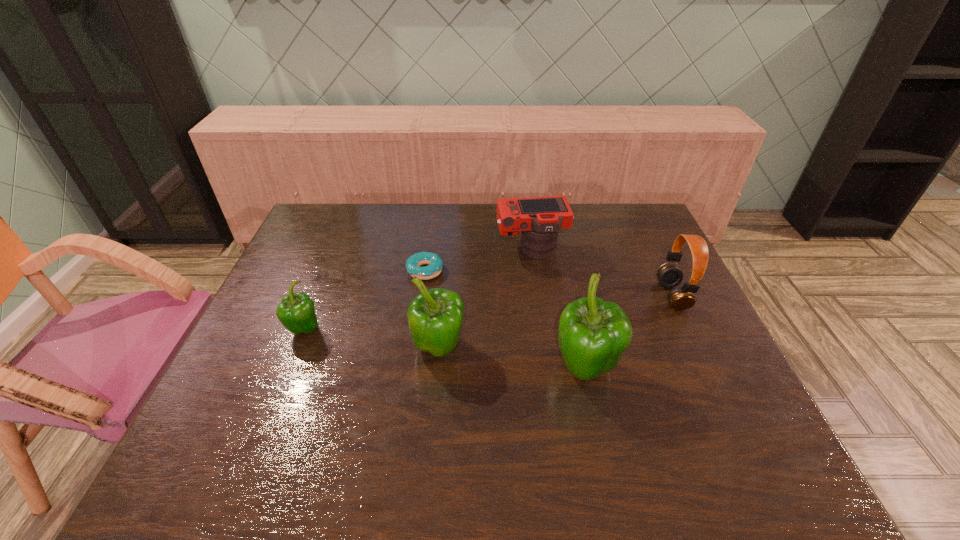
The height and width of the screenshot is (540, 960). In order to click on vacant space situated 0.280m on the front of the camera in this screenshot , I will do 544,333.

Find the location of a particular element. Image resolution: width=960 pixels, height=540 pixels. vacant space located 0.150m on the back of the doughnut is located at coordinates (431, 232).

Find the location of a particular element. The height and width of the screenshot is (540, 960). vacant space located on the ear cups of the headset is located at coordinates (572, 296).

Locate an element on the screen. The height and width of the screenshot is (540, 960). free region located 0.070m on the ear cups of the headset is located at coordinates (636, 296).

Locate an element on the screen. The width and height of the screenshot is (960, 540). vacant region located on the ear cups of the headset is located at coordinates (538, 296).

I want to click on object positioned at the far edge, so click(539, 219).

You are a GUI agent. You are given a task and a screenshot of the screen. Output one action in this format:
    pyautogui.click(x=<x>, y=<y>)
    Task: Click on the object that is at the near edge
    The image size is (960, 540).
    Given the screenshot: What is the action you would take?
    pyautogui.click(x=593, y=334)

Image resolution: width=960 pixels, height=540 pixels. Find the location of `object present at the left edge`. object present at the left edge is located at coordinates (296, 312).

Where is `object that is at the right edge`? The image size is (960, 540). object that is at the right edge is located at coordinates (669, 275).

In the image, there is a desktop. Where is `vacant space at the far edge`? Image resolution: width=960 pixels, height=540 pixels. vacant space at the far edge is located at coordinates (446, 205).